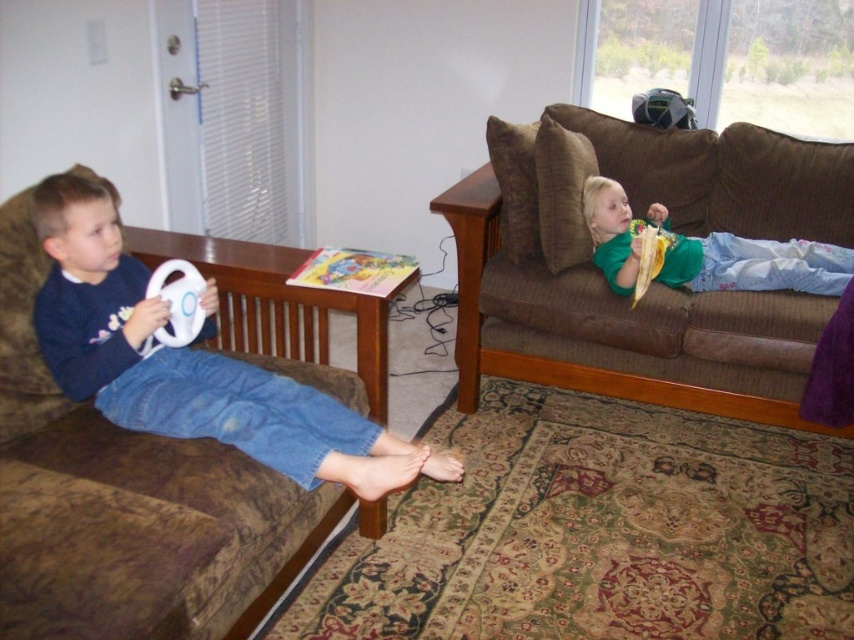
Does brown corduroy couch at right appear under white matte steering wheel at left?

Actually, brown corduroy couch at right is above white matte steering wheel at left.

Which is below, brown corduroy couch at right or white matte steering wheel at left?

white matte steering wheel at left is lower down.

I want to click on brown corduroy couch at right, so click(652, 284).

In order to click on brown corduroy couch at right in this screenshot , I will do `click(652, 284)`.

How far apart are green cotton shirt at upper right and white matte steering wheel at left?

4.64 feet

From the picture: Who is shorter, green cotton shirt at upper right or white matte steering wheel at left?

With less height is white matte steering wheel at left.

Measure the distance between green cotton shirt at upper right and camera.

The distance of green cotton shirt at upper right from camera is 2.35 meters.

You are a GUI agent. You are given a task and a screenshot of the screen. Output one action in this format:
    pyautogui.click(x=<x>, y=<y>)
    Task: Click on the green cotton shirt at upper right
    
    Given the screenshot: What is the action you would take?
    pyautogui.click(x=700, y=252)

How distant is brown corduroy couch at right from brown fabric couch at left?

3.58 feet

Can you confirm if brown corduroy couch at right is wider than brown fabric couch at left?

Yes.

Does point (457, 186) lie behind point (329, 376)?

Yes, it is.

I want to click on brown corduroy couch at right, so click(652, 284).